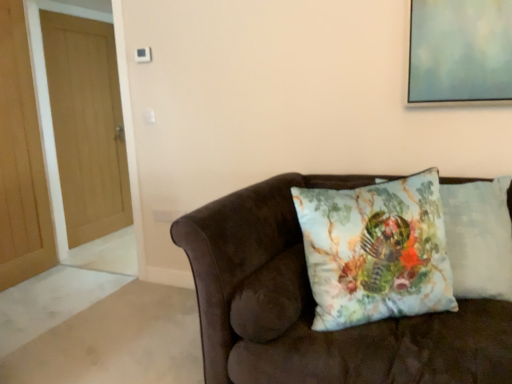
Question: Considering the relative sizes of floral cotton cushion at center, positioned as the 2th pillow in right-to-left order, and light brown wood door at left, arranged as the 1th door when viewed from the front, in the image provided, is floral cotton cushion at center, positioned as the 2th pillow in right-to-left order, thinner than light brown wood door at left, arranged as the 1th door when viewed from the front,?

Choices:
 (A) yes
 (B) no

Answer: (B)

Question: Is floral cotton cushion at center, positioned as the 2th pillow in right-to-left order, shorter than light brown wood door at left, which ranks as the 2th door in back-to-front order?

Choices:
 (A) no
 (B) yes

Answer: (B)

Question: Is floral cotton cushion at center, arranged as the 1th pillow when viewed from the left, positioned before light brown wood door at left, arranged as the 1th door when viewed from the front?

Choices:
 (A) yes
 (B) no

Answer: (A)

Question: Is floral cotton cushion at center, arranged as the 1th pillow when viewed from the left, with light brown wood door at left, which ranks as the 2th door in back-to-front order?

Choices:
 (A) no
 (B) yes

Answer: (A)

Question: Does floral cotton cushion at center, arranged as the 1th pillow when viewed from the left, lie behind light brown wood door at left, arranged as the 1th door when viewed from the front?

Choices:
 (A) no
 (B) yes

Answer: (A)

Question: From a real-world perspective, is floral cotton cushion at center, arranged as the 1th pillow when viewed from the left, under light brown wood door at left, arranged as the 1th door when viewed from the front?

Choices:
 (A) yes
 (B) no

Answer: (A)

Question: Would you say velvet brown couch at center contains light brown wood door at left, arranged as the 1th door when viewed from the front?

Choices:
 (A) yes
 (B) no

Answer: (B)

Question: Is velvet brown couch at center to the right of light brown wood door at left, which ranks as the 2th door in back-to-front order, from the viewer's perspective?

Choices:
 (A) yes
 (B) no

Answer: (A)

Question: From a real-world perspective, is velvet brown couch at center under light brown wood door at left, which ranks as the 2th door in back-to-front order?

Choices:
 (A) yes
 (B) no

Answer: (A)

Question: Can you confirm if velvet brown couch at center is positioned to the left of light brown wood door at left, arranged as the 1th door when viewed from the front?

Choices:
 (A) yes
 (B) no

Answer: (B)

Question: From a real-world perspective, is velvet brown couch at center positioned over light brown wood door at left, arranged as the 1th door when viewed from the front, based on gravity?

Choices:
 (A) yes
 (B) no

Answer: (B)

Question: Is velvet brown couch at center wider than light brown wood door at left, arranged as the 1th door when viewed from the front?

Choices:
 (A) yes
 (B) no

Answer: (A)

Question: Can you confirm if light brown wood door at left, arranged as the 1th door when viewed from the front, is positioned to the right of velvet brown couch at center?

Choices:
 (A) no
 (B) yes

Answer: (A)